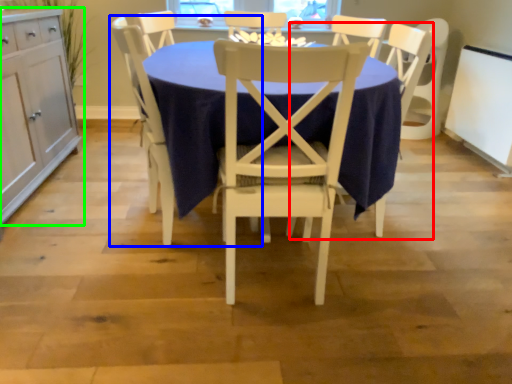
Question: Considering the real-world distances, which object is closest to armchair (highlighted by a red box)? chair (highlighted by a blue box) or cabinetry (highlighted by a green box).

Choices:
 (A) chair
 (B) cabinetry

Answer: (A)